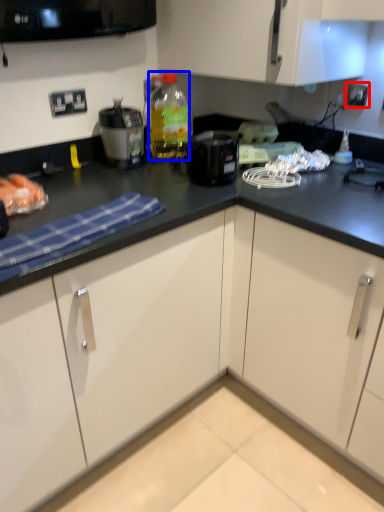
Question: Among these objects, which one is nearest to the camera, electric outlet (highlighted by a red box) or bottle (highlighted by a blue box)?

Choices:
 (A) electric outlet
 (B) bottle

Answer: (B)